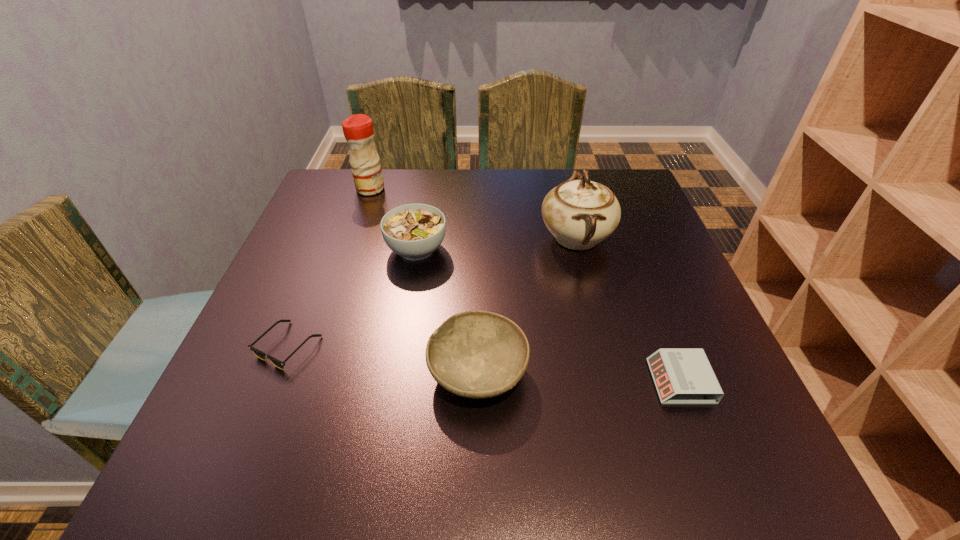
Identify the location of empty space that is in between the farthest object and the third shortest object. (424, 280).

Image resolution: width=960 pixels, height=540 pixels. I want to click on vacant point located between the sunglasses and the fourth shortest object, so click(x=352, y=298).

Where is `free space that is in between the third shortest object and the shortest object`? Image resolution: width=960 pixels, height=540 pixels. free space that is in between the third shortest object and the shortest object is located at coordinates (383, 359).

Identify the location of vacant area that lies between the chinaware and the fifth tallest object. This screenshot has width=960, height=540. (628, 309).

Identify the location of object that is the fifth closest to the third shortest object. The height and width of the screenshot is (540, 960). (358, 130).

Identify the location of the second closest object to the fourth shortest object. This screenshot has width=960, height=540. (258, 353).

Find the location of a particular element. The height and width of the screenshot is (540, 960). vacant space that satisfies the following two spatial constraints: 1. on the lenses of the sunglasses; 2. on the right side of the third shortest object is located at coordinates (277, 372).

What are the coordinates of `vacant area in the image that satisfies the following two spatial constraints: 1. on the lenses of the second shortest object; 2. on the right side of the sunglasses` in the screenshot? It's located at (274, 381).

This screenshot has width=960, height=540. I want to click on free space that satisfies the following two spatial constraints: 1. on the lenses of the fifth tallest object; 2. on the left side of the shortest object, so click(274, 381).